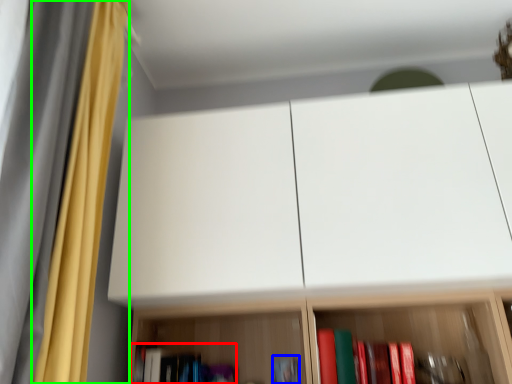
Question: Which object is positioned farthest from book (highlighted by a red box)? Select from book (highlighted by a blue box) and curtain (highlighted by a green box).

Choices:
 (A) book
 (B) curtain

Answer: (B)